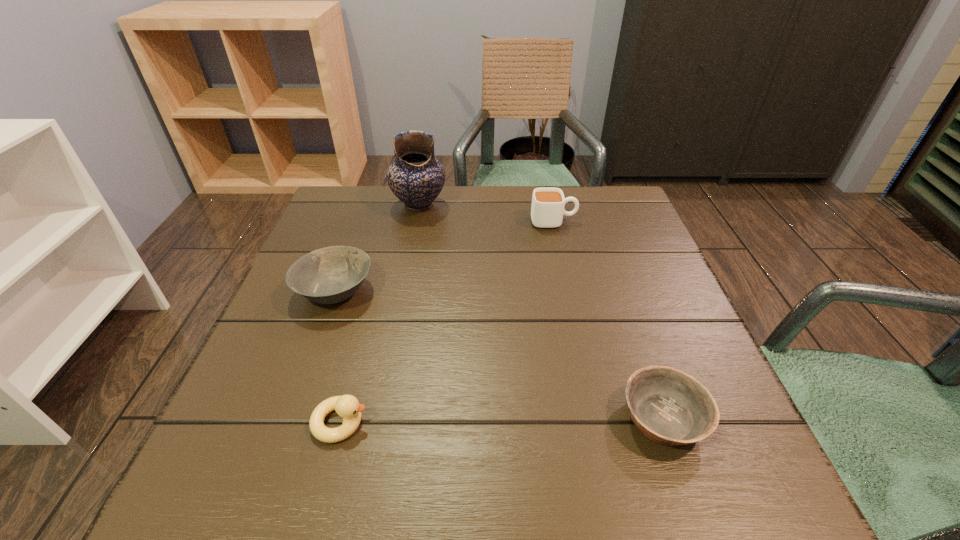
Locate an element on the screen. This screenshot has height=540, width=960. blank space at the near edge is located at coordinates (656, 508).

Where is `vacant space at the left edge of the desktop`? vacant space at the left edge of the desktop is located at coordinates (336, 239).

The height and width of the screenshot is (540, 960). Identify the location of free region at the right edge of the desktop. (623, 260).

Locate an element on the screen. vacant space at the far left corner of the desktop is located at coordinates (311, 234).

The image size is (960, 540). I want to click on vacant space at the near left corner of the desktop, so click(300, 487).

I want to click on free space at the far right corner of the desktop, so tap(620, 191).

The height and width of the screenshot is (540, 960). Find the location of `vacant space at the near right corner`. vacant space at the near right corner is located at coordinates (666, 490).

This screenshot has width=960, height=540. What are the coordinates of `vacant area that lies between the cup and the nearer bowl` in the screenshot? It's located at (609, 320).

You are a GUI agent. You are given a task and a screenshot of the screen. Output one action in this format:
    pyautogui.click(x=<x>, y=<y>)
    Task: Click on the vacant area between the duckling and the second tallest object
    The image size is (960, 540).
    Given the screenshot: What is the action you would take?
    pyautogui.click(x=447, y=322)

The height and width of the screenshot is (540, 960). In order to click on free space between the duckling and the tallest object in this screenshot , I will do `click(380, 314)`.